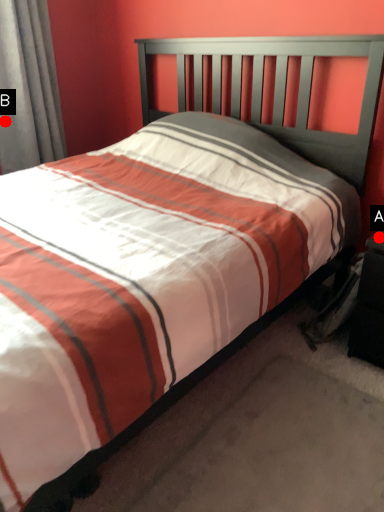
Question: Two points are circled on the image, labeled by A and B beside each circle. Which point is closer to the camera?

Choices:
 (A) A is closer
 (B) B is closer

Answer: (A)